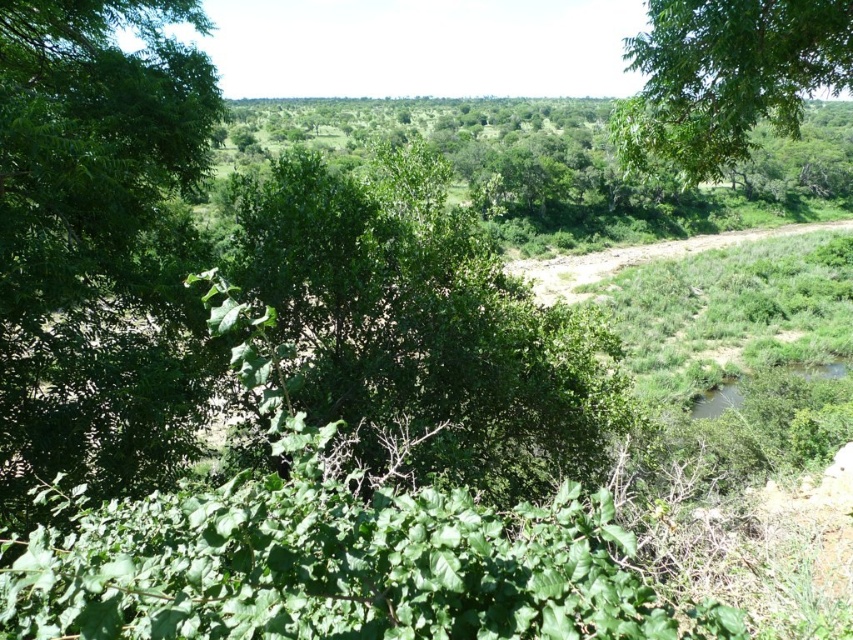
You are standing at the edge of the dirt path in the midground of the landscape. You see the green leafy tree at center and the green leafy tree at upper right. Which tree is closer to your right side?

The green leafy tree at upper right is closer to your right side because it is positioned to the right of the green leafy tree at center.

You are standing at the edge of the dirt path in the midground and want to walk towards the green leafy tree at upper right. Which direction should you go to avoid the green leafy tree at center?

To avoid the green leafy tree at center, you should walk towards the lower part of the dirt path since the green leafy tree at center is above the green leafy tree at upper right, meaning it is positioned higher up in the scene.

From the picture: You are standing 2 meters away from the green leafy tree at center. Can you reach the tree without moving closer?

The green leafy tree at center is 2.58 meters away from the viewer. Since you are already 2 meters away, you need to move 0.58 meters closer to reach it.